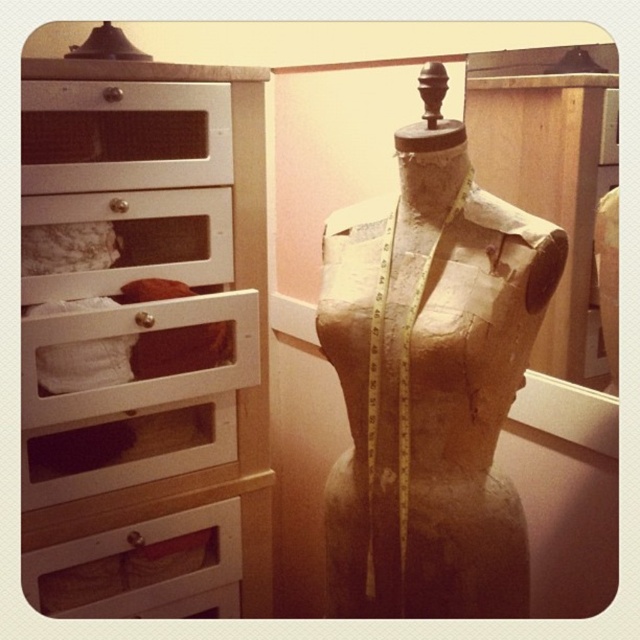
Question: Is white wood drawer at upper left to the left of white fabric drawer at left from the viewer's perspective?

Choices:
 (A) no
 (B) yes

Answer: (A)

Question: Where is burlap-like brown mannequin torso at center located in relation to wooden drawer at lower left in the image?

Choices:
 (A) below
 (B) above

Answer: (B)

Question: Is white wood dresser at left closer to the viewer compared to white wood drawer at upper left?

Choices:
 (A) yes
 (B) no

Answer: (A)

Question: Which point appears farthest from the camera in this image?

Choices:
 (A) (106, 580)
 (B) (67, 179)
 (C) (26, 225)

Answer: (A)

Question: Which object appears farthest from the camera in this image?

Choices:
 (A) white fabric drawer at left
 (B) white wood drawer at upper left
 (C) burlap-like brown mannequin torso at center
 (D) wooden drawer at lower left

Answer: (D)

Question: Which object is closer to the camera taking this photo?

Choices:
 (A) white fabric drawer at left
 (B) burlap-like brown mannequin torso at center
 (C) white wood dresser at left
 (D) white wood drawer at upper left

Answer: (B)